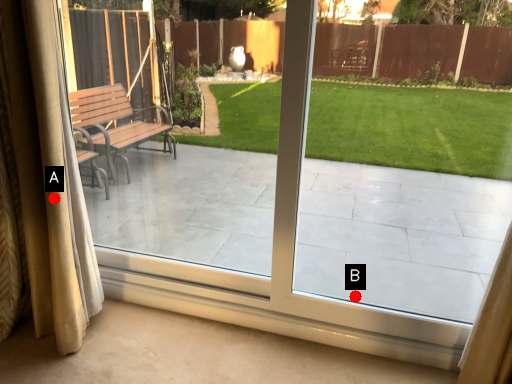
Question: Two points are circled on the image, labeled by A and B beside each circle. Which point is closer to the camera?

Choices:
 (A) A is closer
 (B) B is closer

Answer: (A)